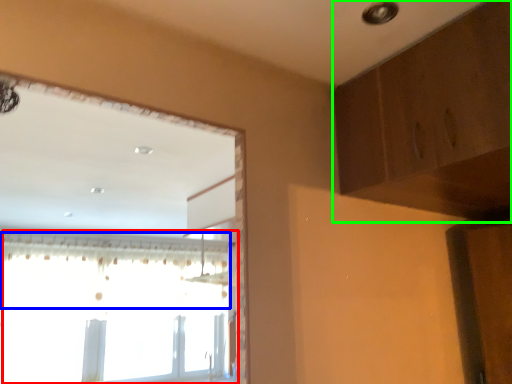
Question: Which object is the farthest from window (highlighted by a red box)? Choose among these: curtain (highlighted by a blue box) or dresser (highlighted by a green box).

Choices:
 (A) curtain
 (B) dresser

Answer: (B)